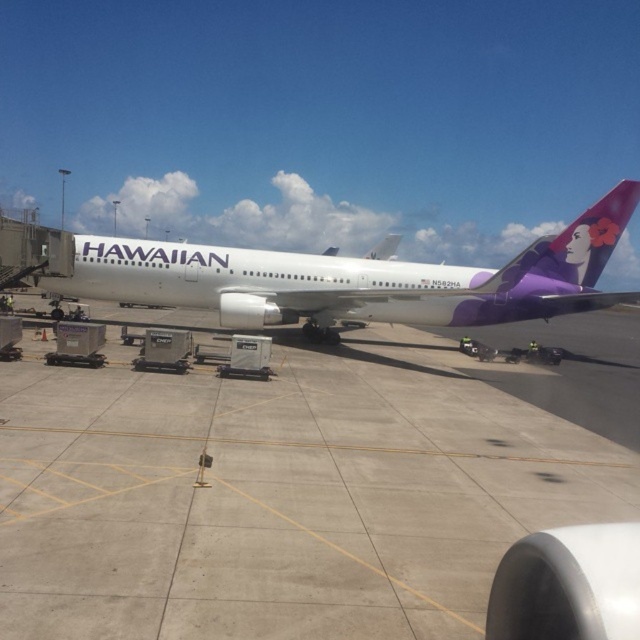
Question: Which object is farther from the camera taking this photo?

Choices:
 (A) concrete at center
 (B) white glossy airplane at center

Answer: (B)

Question: Can you confirm if concrete at center is positioned to the left of white glossy airplane at center?

Choices:
 (A) yes
 (B) no

Answer: (A)

Question: Is concrete at center behind white glossy airplane at center?

Choices:
 (A) no
 (B) yes

Answer: (A)

Question: Is concrete at center bigger than white glossy airplane at center?

Choices:
 (A) no
 (B) yes

Answer: (B)